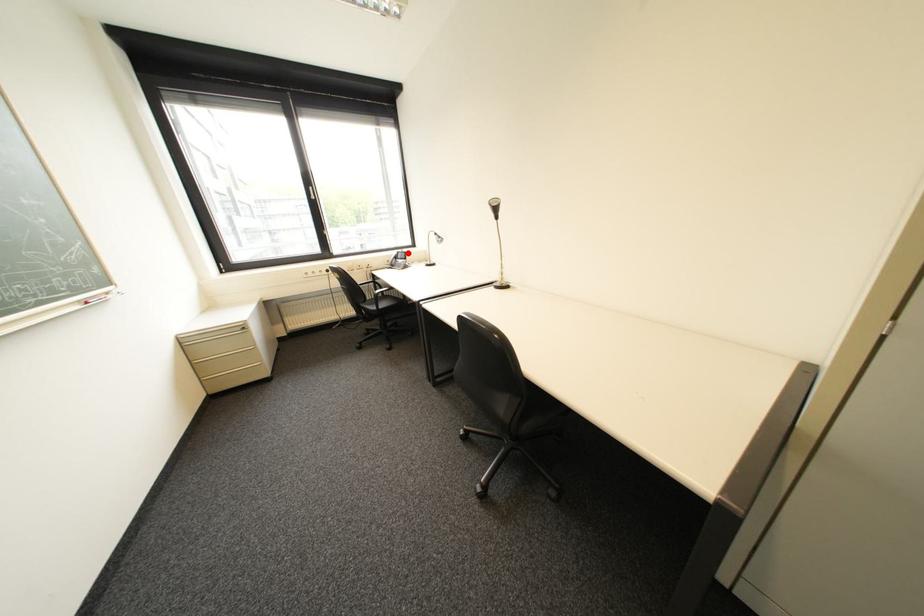
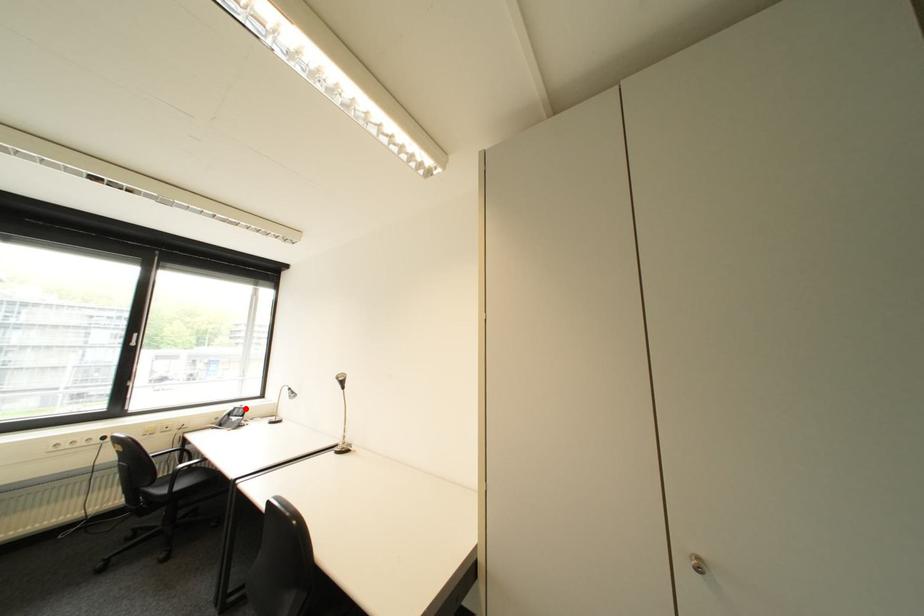
I am providing you with two images of the same scene from different viewpoints. A red point is marked on the first image and another point is marked on the second image. Are the points marked in image1 and image2 representing the same 3D position?

Yes